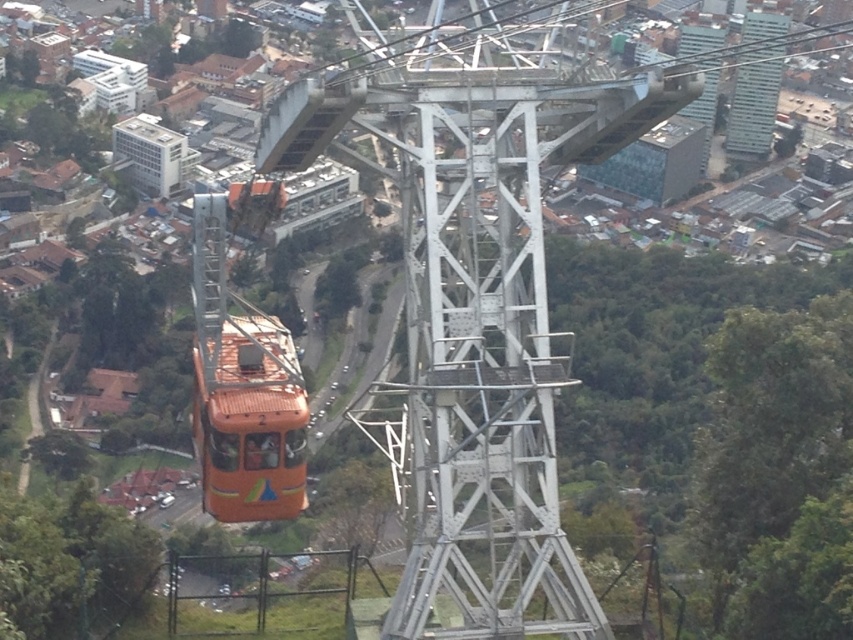
Is metallic glass skyscraper at upper right bigger than white matte building at upper left?

Indeed, metallic glass skyscraper at upper right has a larger size compared to white matte building at upper left.

Is point (734, 83) farther from viewer compared to point (177, 138)?

Yes, it is behind point (177, 138).

Which is in front, point (756, 51) or point (178, 157)?

Positioned in front is point (756, 51).

The height and width of the screenshot is (640, 853). I want to click on metallic glass skyscraper at upper right, so click(753, 104).

Is metallic glass skyscraper at upper right wider than metallic silver tower at upper right?

In fact, metallic glass skyscraper at upper right might be narrower than metallic silver tower at upper right.

Is point (724, 129) farther from camera compared to point (720, 42)?

Yes, point (724, 129) is behind point (720, 42).

This screenshot has width=853, height=640. I want to click on metallic glass skyscraper at upper right, so click(753, 104).

Describe the element at coordinates (151, 154) in the screenshot. This screenshot has height=640, width=853. I see `white matte building at upper left` at that location.

Does white matte building at upper left have a greater height compared to metallic silver tower at upper right?

Incorrect, white matte building at upper left's height is not larger of metallic silver tower at upper right's.

Where is `white matte building at upper left`? This screenshot has height=640, width=853. white matte building at upper left is located at coordinates (151, 154).